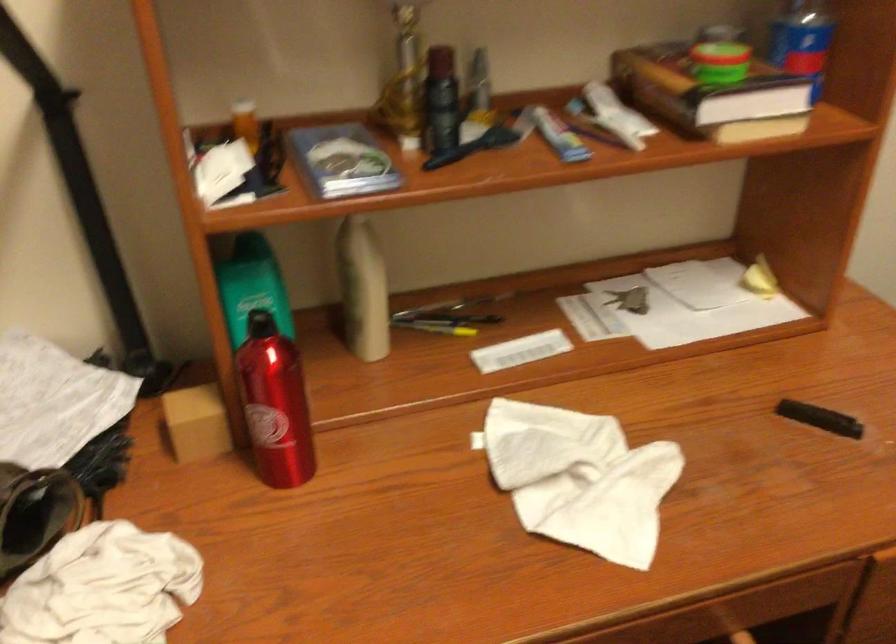
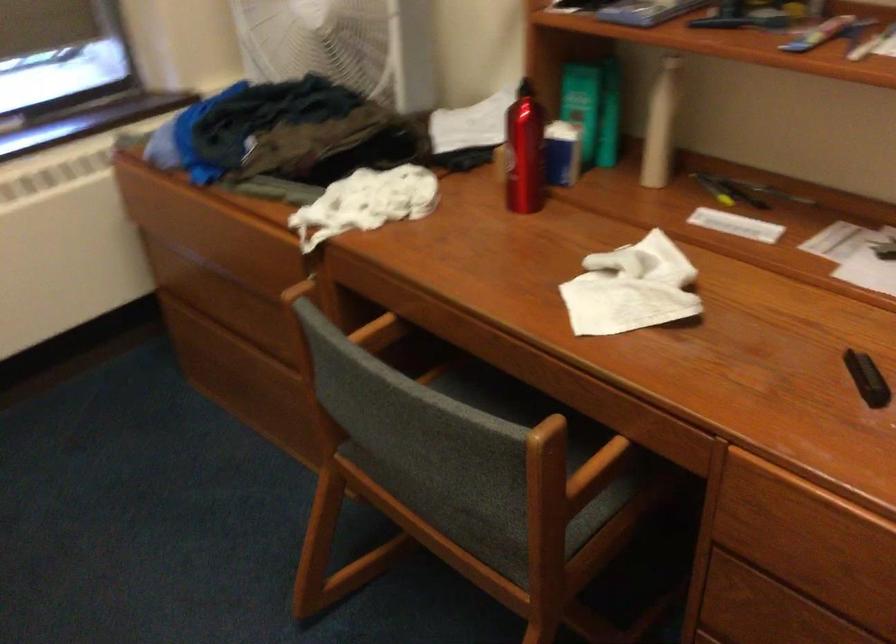
Locate, in the second image, the point that corresponds to point (261, 310) in the first image.

(582, 104)